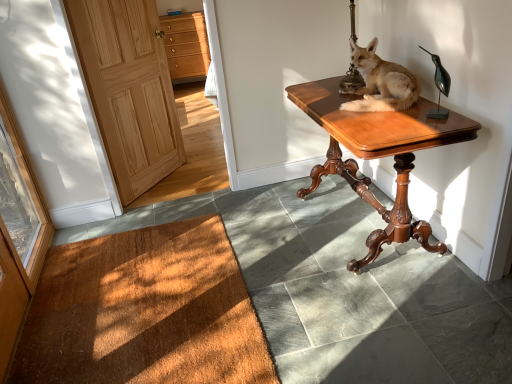
Image resolution: width=512 pixels, height=384 pixels. What are the coordinates of `free point below mahogany wood desk at center (from a real-world perspective)` in the screenshot? It's located at (355, 233).